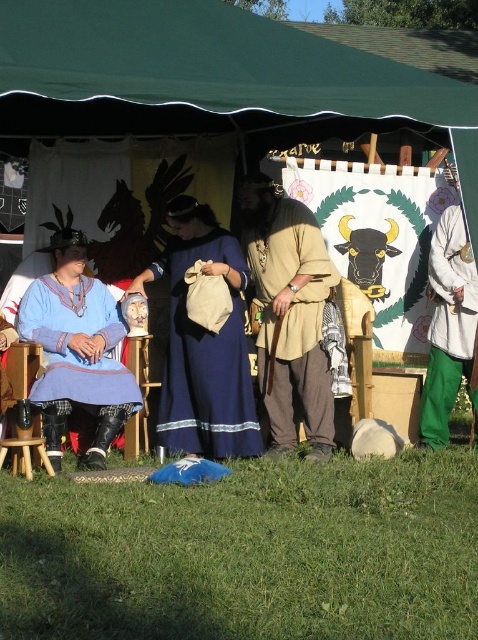
Question: Considering the real-world distances, which object is farthest from the matte blue tunic at left?

Choices:
 (A) green canvas tent at center
 (B) blue cotton dress at center
 (C) beige leather tunic at center

Answer: (A)

Question: Does green canvas tent at center appear on the left side of beige leather tunic at center?

Choices:
 (A) no
 (B) yes

Answer: (B)

Question: Which object is farther from the camera taking this photo?

Choices:
 (A) beige leather tunic at center
 (B) matte blue tunic at left
 (C) blue cotton dress at center

Answer: (A)

Question: Can you confirm if green canvas tent at center is positioned to the left of blue cotton dress at center?

Choices:
 (A) yes
 (B) no

Answer: (B)

Question: Is green canvas tent at center positioned before white cotton pants at right?

Choices:
 (A) yes
 (B) no

Answer: (A)

Question: Among these points, which one is nearest to the camera?

Choices:
 (A) (283, 317)
 (B) (22, 16)

Answer: (B)